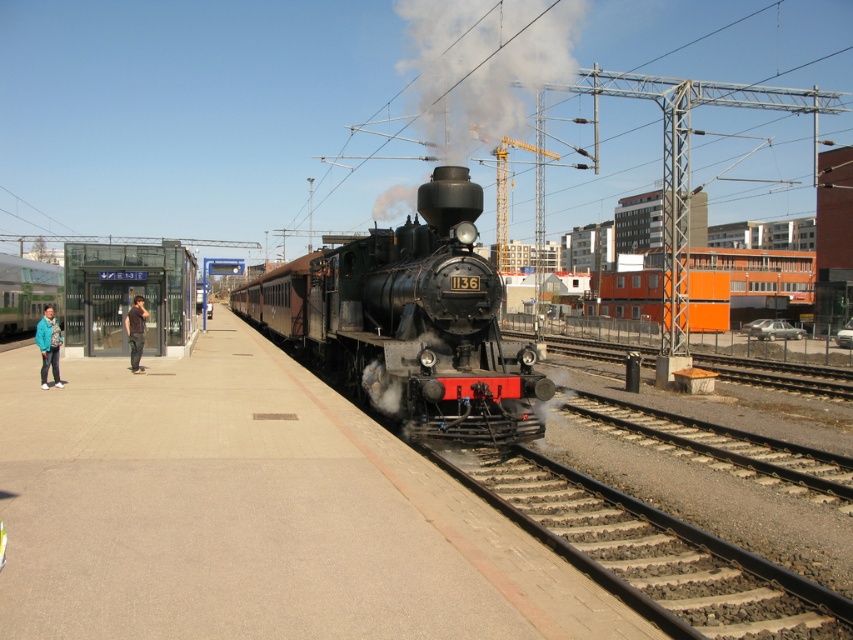
You are a photographer positioned at the train station. You want to capture a photo of the polished black steam locomotive at center and the white smoke at center such that the smoke appears behind the locomotive. Is this possible with your current position?

Yes, because the polished black steam locomotive at center is already positioned in front of the white smoke at center, so capturing the smoke behind the locomotive in the photo is feasible from your current position.